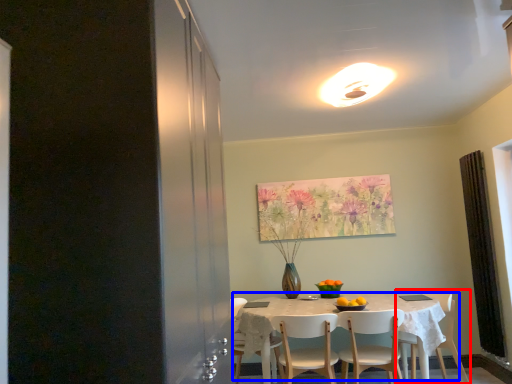
Question: Which object is closer to the camera taking this photo, chair (highlighted by a red box) or kitchen & dining room table (highlighted by a blue box)?

Choices:
 (A) chair
 (B) kitchen & dining room table

Answer: (B)